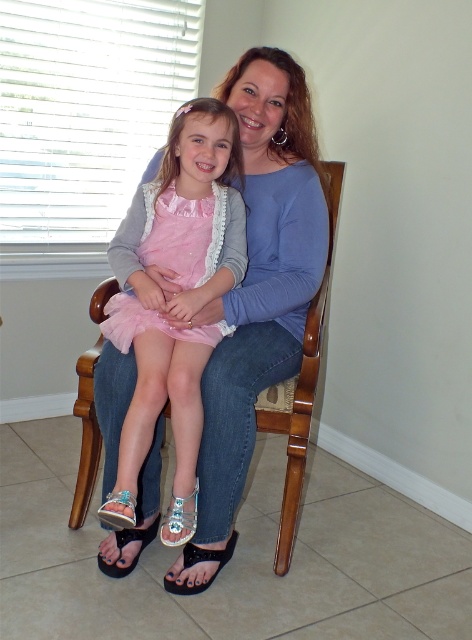
You are a photographer taking a photo of the scene. You notice the pink tulle dress at center and the wooden armchair at center. Which object appears closer to you in the photo?

The pink tulle dress at center appears closer to you because it is positioned closer to the viewer than the wooden armchair at center.